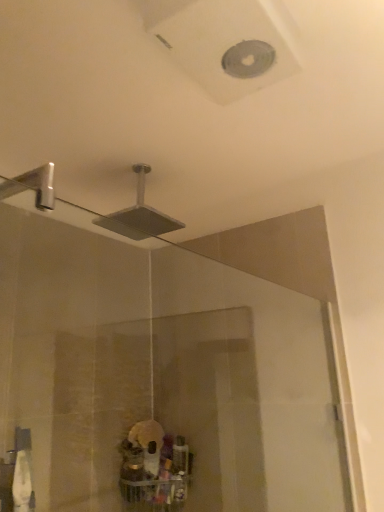
Question: Would you say metallic silver showerhead at upper center is inside or outside transparent glass door at center?

Choices:
 (A) inside
 (B) outside

Answer: (B)

Question: Is point (152, 220) positioned closer to the camera than point (102, 262)?

Choices:
 (A) closer
 (B) farther

Answer: (A)

Question: From a real-world perspective, relative to transparent glass door at center, is metallic silver showerhead at upper center vertically above or below?

Choices:
 (A) above
 (B) below

Answer: (A)

Question: In the image, is transparent glass door at center on the left side or the right side of metallic silver showerhead at upper center?

Choices:
 (A) left
 (B) right

Answer: (B)

Question: Does point (349, 498) appear closer or farther from the camera than point (137, 176)?

Choices:
 (A) farther
 (B) closer

Answer: (B)

Question: Is transparent glass door at center inside the boundaries of metallic silver showerhead at upper center, or outside?

Choices:
 (A) inside
 (B) outside

Answer: (B)

Question: Looking at their shapes, would you say transparent glass door at center is wider or thinner than metallic silver showerhead at upper center?

Choices:
 (A) wide
 (B) thin

Answer: (A)